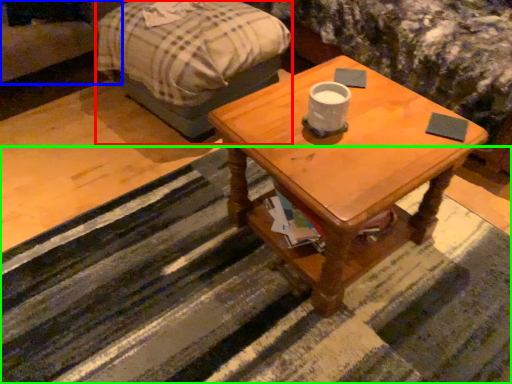
Question: Based on their relative distances, which object is farther from bed frame (highlighted by a red box)? Choose from couch (highlighted by a blue box) and strip (highlighted by a green box).

Choices:
 (A) couch
 (B) strip

Answer: (B)